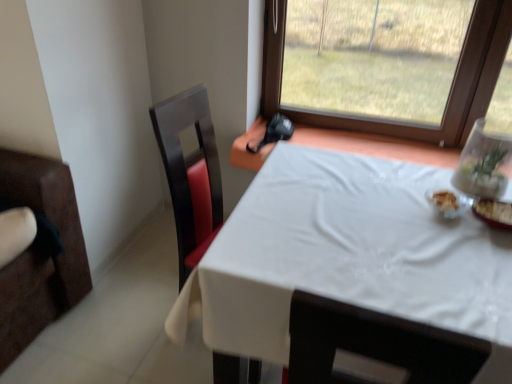
Question: Considering the relative sizes of transparent glass vase at upper right and matte black swivel chair at left in the image provided, is transparent glass vase at upper right bigger than matte black swivel chair at left?

Choices:
 (A) yes
 (B) no

Answer: (B)

Question: Does transparent glass vase at upper right come in front of matte black swivel chair at left?

Choices:
 (A) no
 (B) yes

Answer: (A)

Question: Is transparent glass vase at upper right aimed at matte black swivel chair at left?

Choices:
 (A) no
 (B) yes

Answer: (A)

Question: From the image's perspective, is transparent glass vase at upper right located beneath matte black swivel chair at left?

Choices:
 (A) no
 (B) yes

Answer: (A)

Question: Is transparent glass vase at upper right positioned behind matte black swivel chair at left?

Choices:
 (A) yes
 (B) no

Answer: (A)

Question: Are transparent glass vase at upper right and matte black swivel chair at left making contact?

Choices:
 (A) no
 (B) yes

Answer: (A)

Question: Can you confirm if transparent glass vase at upper right is bigger than white cloth-covered table at center?

Choices:
 (A) no
 (B) yes

Answer: (A)

Question: From a real-world perspective, is transparent glass vase at upper right positioned over white cloth-covered table at center based on gravity?

Choices:
 (A) no
 (B) yes

Answer: (B)

Question: From the image's perspective, would you say transparent glass vase at upper right is positioned over white cloth-covered table at center?

Choices:
 (A) yes
 (B) no

Answer: (A)

Question: Is transparent glass vase at upper right at the left side of white cloth-covered table at center?

Choices:
 (A) no
 (B) yes

Answer: (A)

Question: From a real-world perspective, is transparent glass vase at upper right below white cloth-covered table at center?

Choices:
 (A) no
 (B) yes

Answer: (A)

Question: Is white cloth-covered table at center surrounded by transparent glass vase at upper right?

Choices:
 (A) no
 (B) yes

Answer: (A)

Question: Is white cloth-covered table at center shorter than matte black swivel chair at left?

Choices:
 (A) no
 (B) yes

Answer: (B)